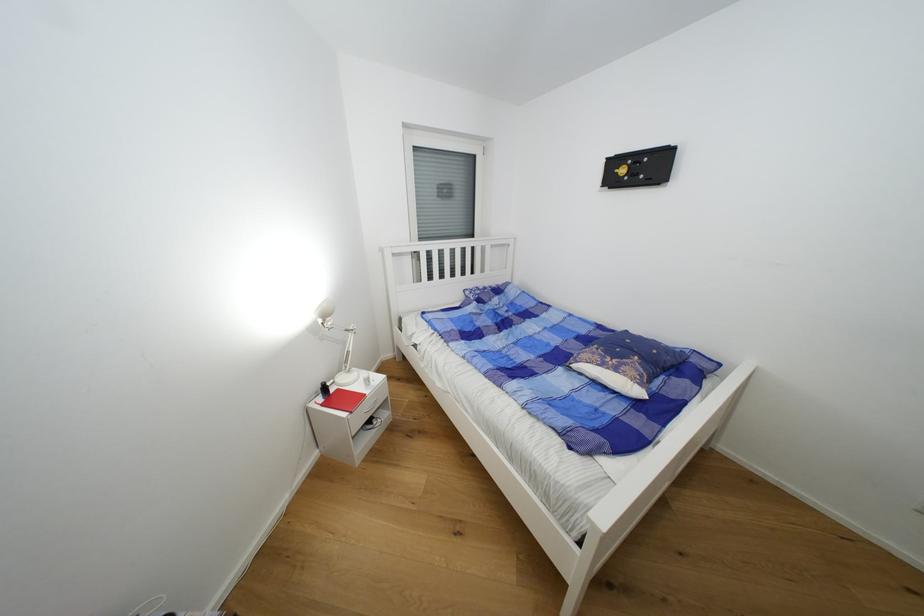
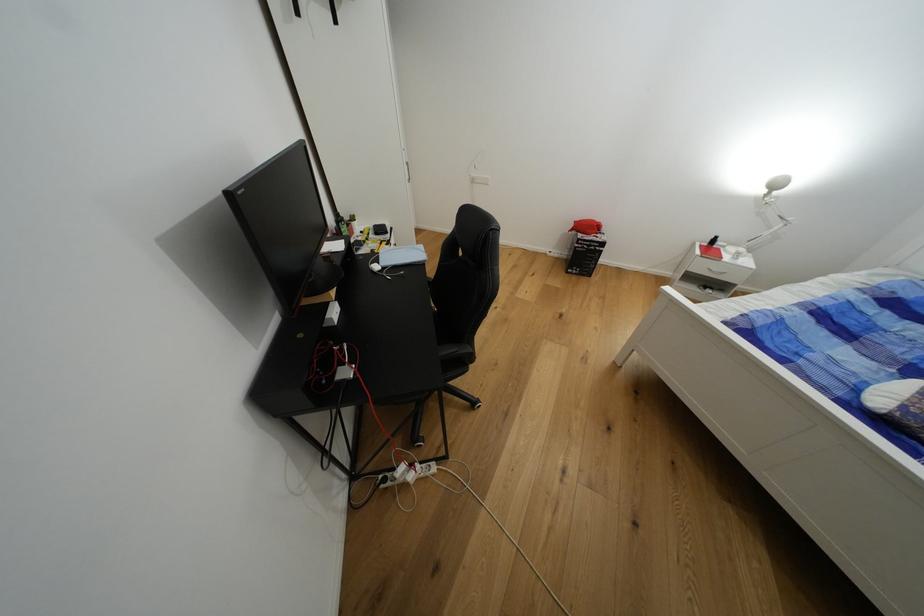
In the second image, find the point that corresponds to the point at 325,323 in the first image.

(771, 193)